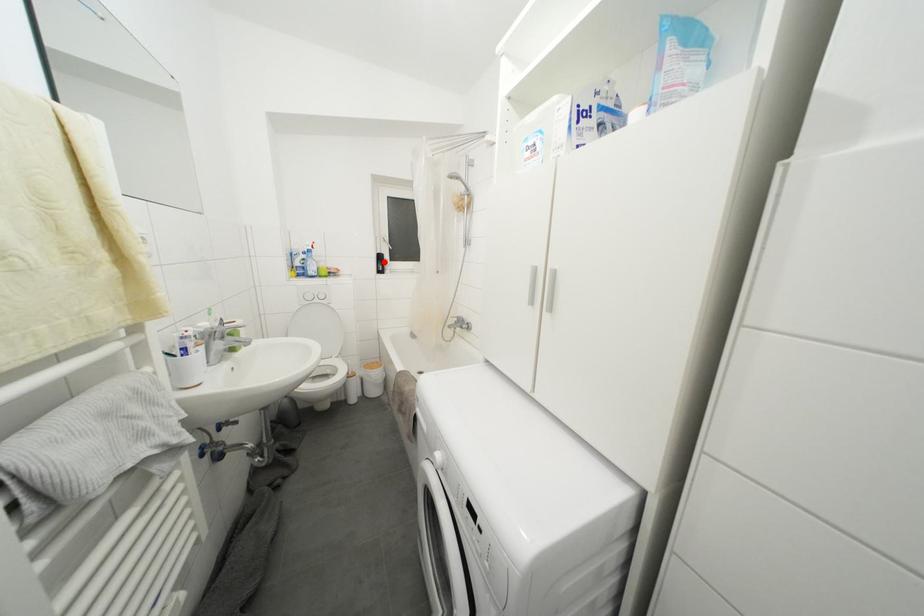
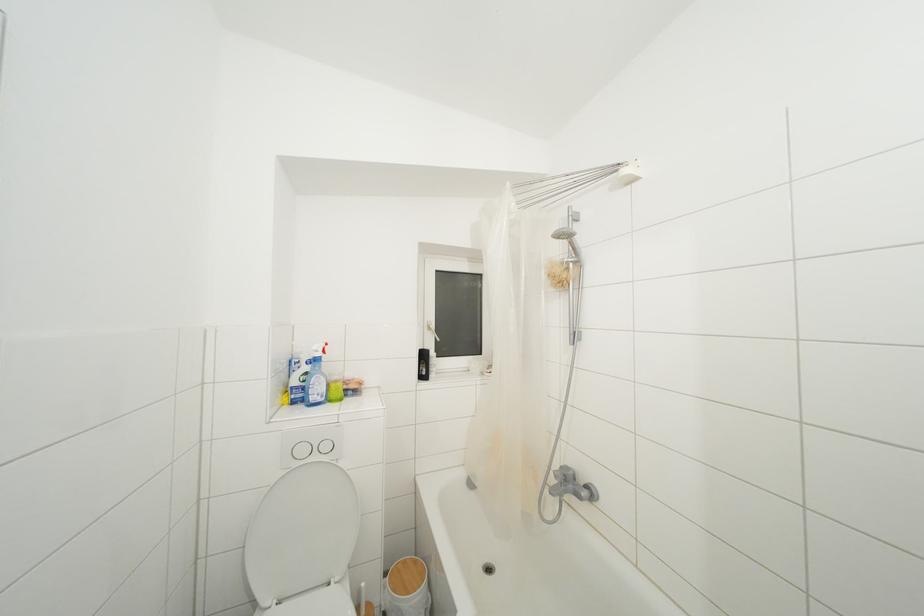
The point at the highlighted location is marked in the first image. Where is the corresponding point in the second image?

(428, 361)